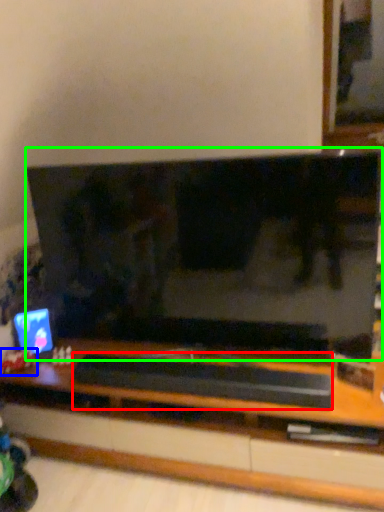
Question: Which object is the farthest from wide (highlighted by a red box)? Choose among these: toy (highlighted by a blue box) or television (highlighted by a green box).

Choices:
 (A) toy
 (B) television

Answer: (A)